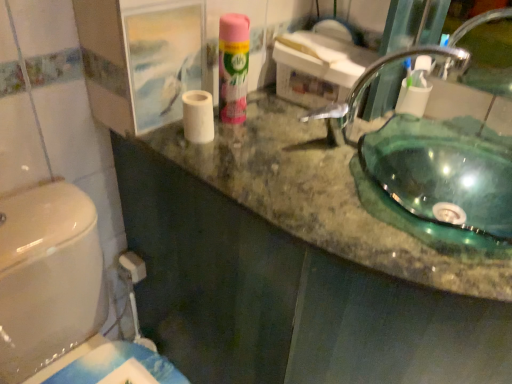
Identify the location of vacant area that is in front of white matte toilet paper at upper right, arranged as the 2th toilet paper when viewed from the front. The height and width of the screenshot is (384, 512). (422, 163).